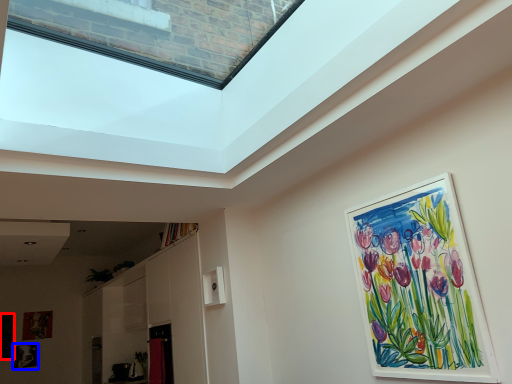
Question: Which of the following is the farthest to the observer, picture frame (highlighted by a red box) or picture frame (highlighted by a blue box)?

Choices:
 (A) picture frame
 (B) picture frame

Answer: (B)